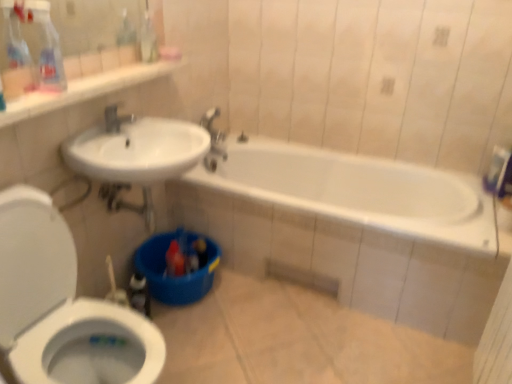
Question: Can you confirm if translucent plastic spray bottle at upper left is taller than white glossy toilet at lower left?

Choices:
 (A) no
 (B) yes

Answer: (A)

Question: Can you confirm if translucent plastic spray bottle at upper left is bigger than white glossy toilet at lower left?

Choices:
 (A) yes
 (B) no

Answer: (B)

Question: Are translucent plastic spray bottle at upper left and white glossy toilet at lower left far apart?

Choices:
 (A) no
 (B) yes

Answer: (A)

Question: Can you confirm if translucent plastic spray bottle at upper left is smaller than white glossy toilet at lower left?

Choices:
 (A) yes
 (B) no

Answer: (A)

Question: From a real-world perspective, is translucent plastic spray bottle at upper left below white glossy toilet at lower left?

Choices:
 (A) yes
 (B) no

Answer: (B)

Question: Can you confirm if translucent plastic spray bottle at upper left is wider than white glossy toilet at lower left?

Choices:
 (A) no
 (B) yes

Answer: (A)

Question: Is silver metallic faucet at upper center directly adjacent to white glossy toilet at lower left?

Choices:
 (A) no
 (B) yes

Answer: (A)

Question: Can you confirm if silver metallic faucet at upper center is positioned to the left of white glossy toilet at lower left?

Choices:
 (A) yes
 (B) no

Answer: (B)

Question: Does silver metallic faucet at upper center have a greater width compared to white glossy toilet at lower left?

Choices:
 (A) no
 (B) yes

Answer: (A)

Question: Is there a large distance between silver metallic faucet at upper center and white glossy toilet at lower left?

Choices:
 (A) yes
 (B) no

Answer: (B)

Question: From a real-world perspective, is silver metallic faucet at upper center on top of white glossy toilet at lower left?

Choices:
 (A) no
 (B) yes

Answer: (B)

Question: Is silver metallic faucet at upper center oriented away from white glossy toilet at lower left?

Choices:
 (A) yes
 (B) no

Answer: (B)

Question: From the image's perspective, is translucent plastic spray bottle at upper left located beneath silver metallic faucet at upper center?

Choices:
 (A) yes
 (B) no

Answer: (B)